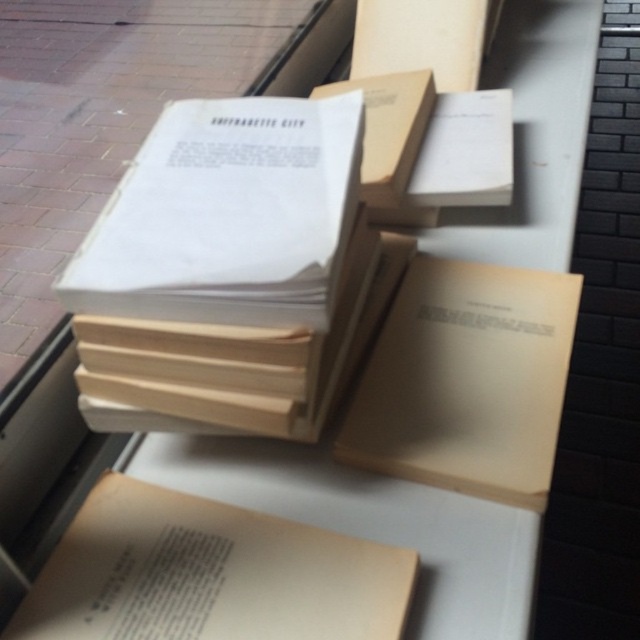
Based on the photo, how much distance is there between beige paper book at lower left and beige cardboard box at center?

beige paper book at lower left and beige cardboard box at center are 8.40 inches apart.

Is point (246, 525) more distant than point (429, 321)?

No, it is in front of (429, 321).

Locate an element on the screen. This screenshot has width=640, height=640. beige paper book at lower left is located at coordinates (209, 573).

At what (x,y) coordinates should I click in order to perform the action: click on beige paper book at lower left. Please return your answer as a coordinate pair (x, y). The width and height of the screenshot is (640, 640). Looking at the image, I should click on (209, 573).

Measure the distance between beige cardboard box at center and camera.

beige cardboard box at center is 22.68 inches away from camera.

Can you confirm if beige cardboard box at center is positioned to the right of matte cardboard box at upper center?

No, beige cardboard box at center is not to the right of matte cardboard box at upper center.

Measure the distance between beige cardboard box at center and camera.

The distance of beige cardboard box at center from camera is 22.68 inches.

The width and height of the screenshot is (640, 640). In order to click on beige cardboard box at center in this screenshot , I will do `click(467, 380)`.

Is point (202, 616) farther from camera compared to point (388, 12)?

No, it is in front of (388, 12).

You are a GUI agent. You are given a task and a screenshot of the screen. Output one action in this format:
    pyautogui.click(x=<x>, y=<y>)
    Task: Click on the beige paper book at lower left
    Image resolution: width=640 pixels, height=640 pixels.
    Given the screenshot: What is the action you would take?
    click(209, 573)